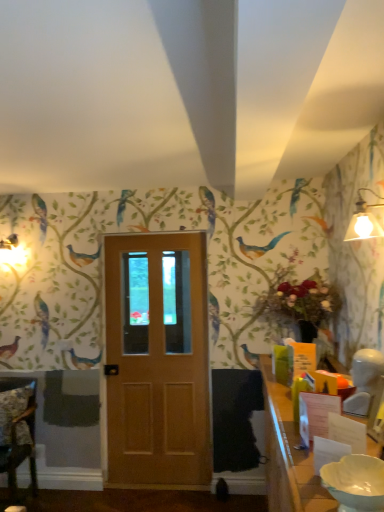
Question: Is wooden chair at lower left at the left side of matte white lampshade at upper right?

Choices:
 (A) no
 (B) yes

Answer: (B)

Question: Is the position of wooden chair at lower left more distant than that of matte white lampshade at upper right?

Choices:
 (A) yes
 (B) no

Answer: (A)

Question: Can you confirm if wooden chair at lower left is smaller than matte white lampshade at upper right?

Choices:
 (A) yes
 (B) no

Answer: (B)

Question: Is matte white lampshade at upper right at the back of wooden chair at lower left?

Choices:
 (A) no
 (B) yes

Answer: (A)

Question: Does wooden chair at lower left have a larger size compared to matte white lampshade at upper right?

Choices:
 (A) no
 (B) yes

Answer: (B)

Question: Based on their positions, is white glossy table at lower right located to the left or right of wooden chair at lower left?

Choices:
 (A) right
 (B) left

Answer: (A)

Question: Is point 297,433 positioned closer to the camera than point 11,382?

Choices:
 (A) closer
 (B) farther

Answer: (A)

Question: From the image's perspective, is white glossy table at lower right positioned above or below wooden chair at lower left?

Choices:
 (A) below
 (B) above

Answer: (B)

Question: Is white glossy table at lower right inside the boundaries of wooden chair at lower left, or outside?

Choices:
 (A) outside
 (B) inside

Answer: (A)

Question: Does point (203, 356) appear closer or farther from the camera than point (357, 214)?

Choices:
 (A) farther
 (B) closer

Answer: (A)

Question: From the image's perspective, is matte wood door at center above or below matte white lampshade at upper right?

Choices:
 (A) below
 (B) above

Answer: (A)

Question: Considering the positions of matte wood door at center and matte white lampshade at upper right in the image, is matte wood door at center taller or shorter than matte white lampshade at upper right?

Choices:
 (A) short
 (B) tall

Answer: (B)

Question: Do you think matte wood door at center is within matte white lampshade at upper right, or outside of it?

Choices:
 (A) inside
 (B) outside

Answer: (B)

Question: From their relative heights in the image, would you say white glossy table at lower right is taller or shorter than matte white lampshade at upper right?

Choices:
 (A) short
 (B) tall

Answer: (B)

Question: In the image, is white glossy table at lower right positioned in front of or behind matte white lampshade at upper right?

Choices:
 (A) front
 (B) behind

Answer: (A)